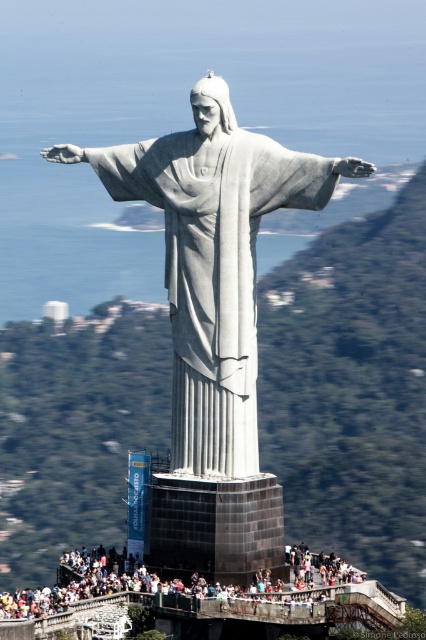
You are standing at the base of Christ the Redeemer statue and want to take a photo that includes both the statue and the ocean. You notice two points marked in your camera viewfinder at coordinates point [247,333] and point [46,602]. Which point is closer to you, the photographer?

Point [247,333] is further to the viewer than point [46,602], so the point closer to you is point [46,602].